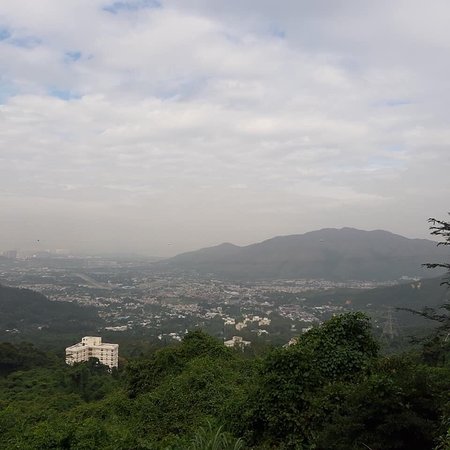
The image size is (450, 450). I want to click on windows, so click(102, 355).